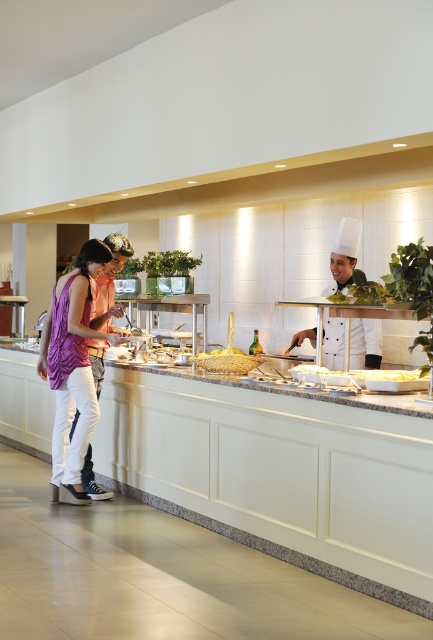
You are a guest at the buffet and want to grab the golden textured bread at center before reaching for the purple fabric dress at left. Is this possible given their positions?

The golden textured bread at center is behind the purple fabric dress at left, so you cannot reach it before the purple fabric dress at left.

You are a guest at the buffet and want to grab both the golden textured bread at center and the yellow matte pasta at center. Since you can only reach forward, which one should you grab first?

You should grab the golden textured bread at center first because it is in front of the yellow matte pasta at center, making it more accessible when reaching forward.

You are a guest at the buffet and want to grab both the golden textured bread at center and the yellow matte pasta at center. If you start from the left side of the buffet counter, which item should you reach for first?

Since the golden textured bread at center is to the left of the yellow matte pasta at center, you should reach for the golden textured bread at center first when starting from the left side of the buffet counter.